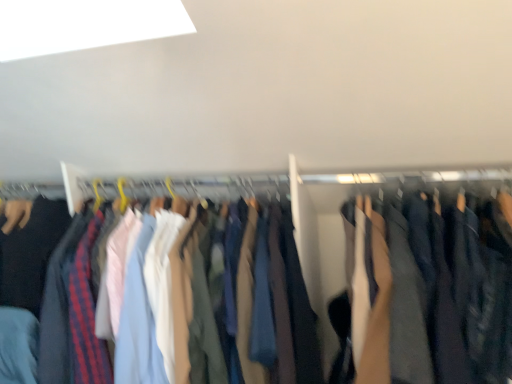
Identify the location of dark gray fabric pants at right. The width and height of the screenshot is (512, 384). (375, 288).

What do you see at coordinates (375, 288) in the screenshot? I see `dark gray fabric pants at right` at bounding box center [375, 288].

In order to face dark blue cotton pants at center, should I rotate leftwards or rightwards?

You should rotate left by 9.767 degrees.

The width and height of the screenshot is (512, 384). I want to click on dark blue cotton pants at center, so point(139,318).

The width and height of the screenshot is (512, 384). Describe the element at coordinates (139, 318) in the screenshot. I see `dark blue cotton pants at center` at that location.

Locate an element on the screen. The image size is (512, 384). dark gray fabric pants at right is located at coordinates (375, 288).

Considering the relative positions of dark blue cotton pants at center and dark gray fabric pants at right in the image provided, is dark blue cotton pants at center to the right of dark gray fabric pants at right from the viewer's perspective?

Incorrect, dark blue cotton pants at center is not on the right side of dark gray fabric pants at right.

Is dark blue cotton pants at center further to the viewer compared to dark gray fabric pants at right?

Yes, dark blue cotton pants at center is behind dark gray fabric pants at right.

Does point (314, 354) appear closer or farther from the camera than point (375, 209)?

Clearly, point (314, 354) is closer to the camera than point (375, 209).

From the image's perspective, is dark blue cotton pants at center below dark gray fabric pants at right?

Yes, from the image's perspective, dark blue cotton pants at center is beneath dark gray fabric pants at right.

From a real-world perspective, which object rests below the other?

In real-world perspective, dark blue cotton pants at center is lower.

Which object is thinner, dark blue cotton pants at center or dark gray fabric pants at right?

Thinner between the two is dark blue cotton pants at center.

Between dark blue cotton pants at center and dark gray fabric pants at right, which one has less height?

With less height is dark gray fabric pants at right.

Does dark blue cotton pants at center have a smaller size compared to dark gray fabric pants at right?

Answer: Actually, dark blue cotton pants at center might be larger than dark gray fabric pants at right.

Is dark gray fabric pants at right a part of dark blue cotton pants at center?

That's incorrect, dark gray fabric pants at right is not inside dark blue cotton pants at center.

Is dark blue cotton pants at center not near dark gray fabric pants at right?

Actually, dark blue cotton pants at center and dark gray fabric pants at right are a little close together.

Is dark gray fabric pants at right at the back of dark blue cotton pants at center?

No, dark blue cotton pants at center's orientation is not away from dark gray fabric pants at right.

How many degrees apart are the facing directions of dark blue cotton pants at center and dark gray fabric pants at right?

5.6e-06 degrees.

Identify the location of trousers located on the left of dark gray fabric pants at right. This screenshot has height=384, width=512. (139, 318).

Is dark gray fabric pants at right to the left of dark blue cotton pants at center from the viewer's perspective?

In fact, dark gray fabric pants at right is to the right of dark blue cotton pants at center.

Is dark gray fabric pants at right closer to the viewer compared to dark blue cotton pants at center?

Yes, it is.

Is point (510, 282) positioned after point (506, 296)?

No.

From the image's perspective, which is above, dark gray fabric pants at right or dark blue cotton pants at center?

dark gray fabric pants at right, from the image's perspective.

From a real-world perspective, who is located higher, dark gray fabric pants at right or dark blue cotton pants at center?

From a 3D spatial view, dark gray fabric pants at right is above.

Is dark gray fabric pants at right wider than dark blue cotton pants at center?

Indeed, dark gray fabric pants at right has a greater width compared to dark blue cotton pants at center.

Considering the sizes of dark gray fabric pants at right and dark blue cotton pants at center in the image, is dark gray fabric pants at right taller or shorter than dark blue cotton pants at center?

Considering their sizes, dark gray fabric pants at right has less height than dark blue cotton pants at center.

From the picture: Is dark gray fabric pants at right smaller than dark blue cotton pants at center?

Correct, dark gray fabric pants at right occupies less space than dark blue cotton pants at center.

Is dark gray fabric pants at right inside the boundaries of dark blue cotton pants at center, or outside?

dark gray fabric pants at right is outside dark blue cotton pants at center.

Is dark gray fabric pants at right in contact with dark blue cotton pants at center?

They are not placed beside each other.

Is dark gray fabric pants at right positioned with its back to dark blue cotton pants at center?

No, dark gray fabric pants at right is not facing the opposite direction of dark blue cotton pants at center.

How many degrees apart are the facing directions of dark gray fabric pants at right and dark blue cotton pants at center?

The angular difference between dark gray fabric pants at right and dark blue cotton pants at center is 5.6e-06 degrees.

Measure the distance from dark gray fabric pants at right to dark blue cotton pants at center.

dark gray fabric pants at right and dark blue cotton pants at center are 6.59 inches apart.

At what (x,y) coordinates should I click in order to perform the action: click on trousers on the left of dark gray fabric pants at right. Please return your answer as a coordinate pair (x, y). Image resolution: width=512 pixels, height=384 pixels. Looking at the image, I should click on (139, 318).

Find the location of a particular element. The image size is (512, 384). trousers that appears on the left of dark gray fabric pants at right is located at coordinates (139, 318).

The height and width of the screenshot is (384, 512). In order to click on trousers beneath the dark gray fabric pants at right (from a real-world perspective) in this screenshot , I will do `click(139, 318)`.